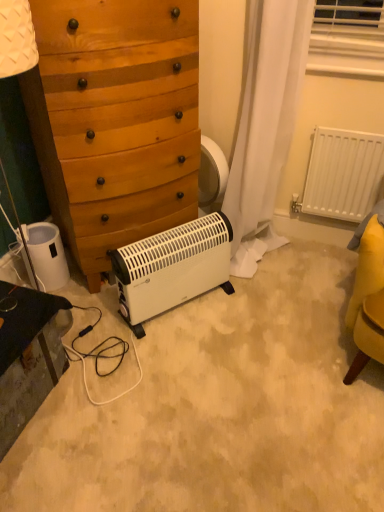
This screenshot has width=384, height=512. In order to click on vacant region in front of wooden chest of drawers at center in this screenshot , I will do `click(144, 345)`.